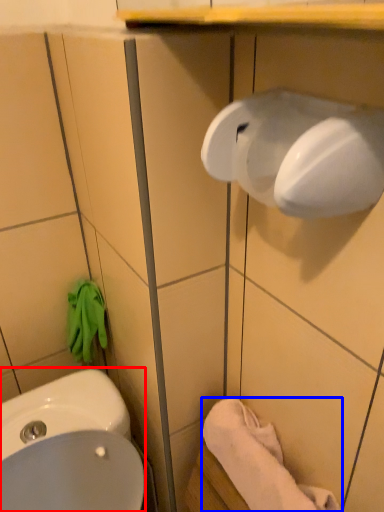
Question: Which point is closer to the camera, sink (highlighted by a red box) or towel/napkin (highlighted by a blue box)?

Choices:
 (A) sink
 (B) towel/napkin

Answer: (A)